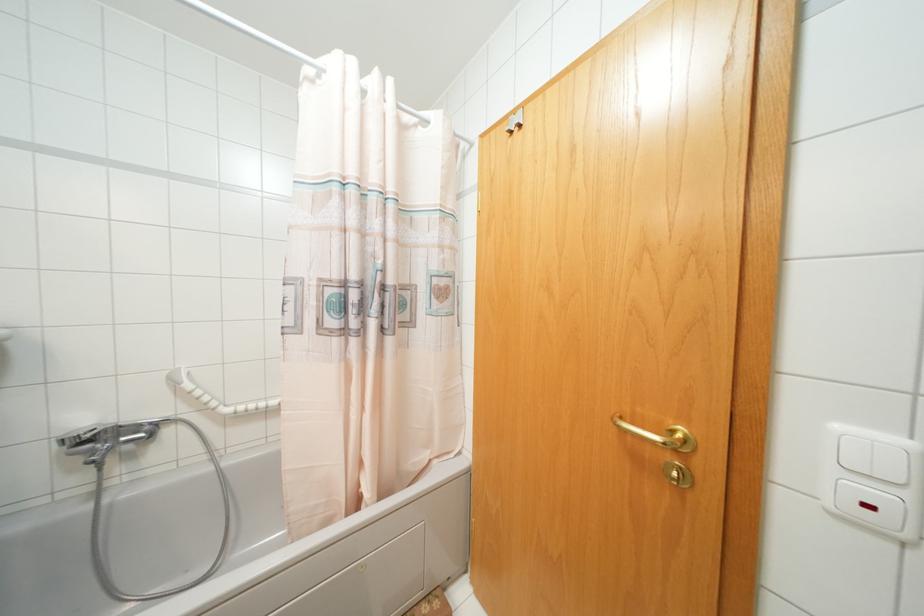
Locate an element on the screen. The height and width of the screenshot is (616, 924). white light switch is located at coordinates [x=871, y=454].